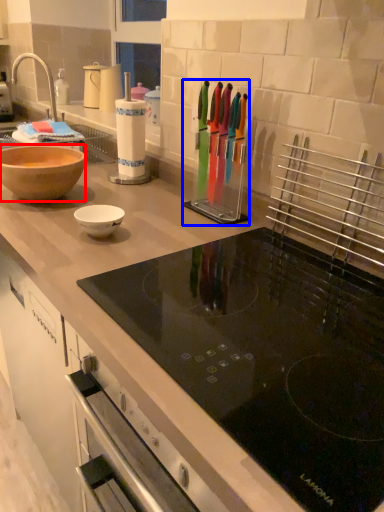
Question: Which object appears farthest to the camera in this image, bowl (highlighted by a red box) or appliance (highlighted by a blue box)?

Choices:
 (A) bowl
 (B) appliance

Answer: (A)